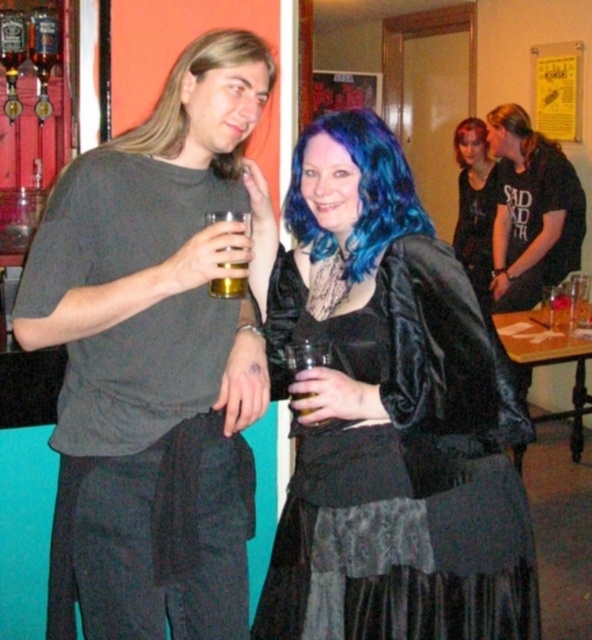
Is gray matte t-shirt at center to the left of blue shiny hair at upper center from the viewer's perspective?

Yes, gray matte t-shirt at center is to the left of blue shiny hair at upper center.

Looking at this image, does gray matte t-shirt at center come in front of blue shiny hair at upper center?

That is True.

Between point (120, 480) and point (461, 129), which one is positioned behind?

Positioned behind is point (461, 129).

I want to click on gray matte t-shirt at center, so click(153, 360).

Who is more forward, (x=74, y=204) or (x=358, y=582)?

Point (x=74, y=204) is more forward.

This screenshot has height=640, width=592. What are the coordinates of `gray matte t-shirt at center` in the screenshot? It's located at (153, 360).

Where is `gray matte t-shirt at center`? This screenshot has height=640, width=592. gray matte t-shirt at center is located at coordinates (153, 360).

Is point (461, 196) positioned in front of point (555, 145)?

No.

Between shiny black shirt at upper right and blondehair at right, which one appears on the right side from the viewer's perspective?

blondehair at right

Is point (487, 161) positioned in front of point (558, 147)?

No, (487, 161) is behind (558, 147).

Locate an element on the screen. The width and height of the screenshot is (592, 640). shiny black shirt at upper right is located at coordinates (474, 205).